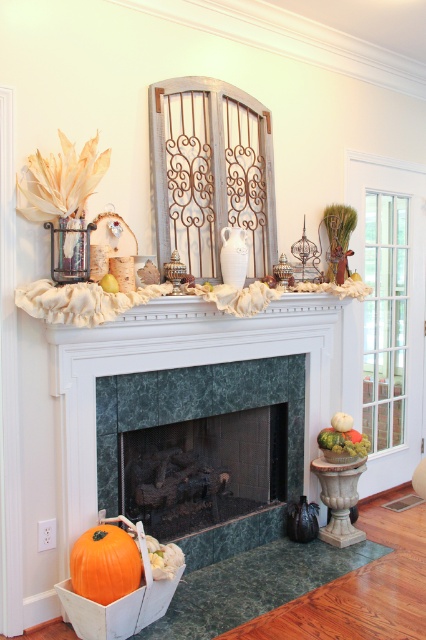
Question: Which point is closer to the camera?

Choices:
 (A) orange matte pumpkin at lower left
 (B) green marble fireplace at center

Answer: (A)

Question: Where is green marble fireplace at center located in relation to orange matte pumpkin at lower left in the image?

Choices:
 (A) right
 (B) left

Answer: (A)

Question: From the image, what is the correct spatial relationship of green marble fireplace at center in relation to orange matte pumpkin at lower left?

Choices:
 (A) right
 (B) left

Answer: (A)

Question: Does green marble fireplace at center appear under orange matte pumpkin at lower left?

Choices:
 (A) yes
 (B) no

Answer: (B)

Question: Which point is farther to the camera?

Choices:
 (A) green marble fireplace at center
 (B) orange matte pumpkin at lower left

Answer: (A)